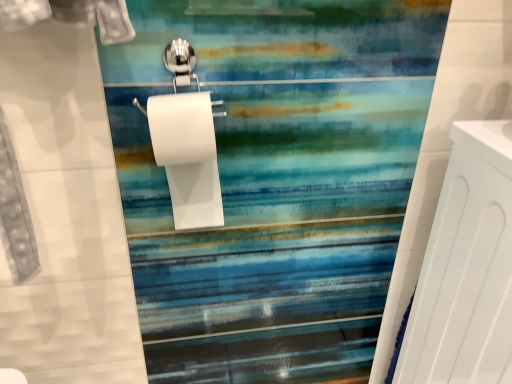
Identify the location of white matte toilet paper at center. (187, 156).

Measure the distance between point (188,149) and camera.

A distance of 25.91 inches exists between point (188,149) and camera.

The image size is (512, 384). What do you see at coordinates (187, 156) in the screenshot?
I see `white matte toilet paper at center` at bounding box center [187, 156].

Image resolution: width=512 pixels, height=384 pixels. Describe the element at coordinates (466, 268) in the screenshot. I see `white matte radiator at right` at that location.

Identify the location of white matte radiator at right. (466, 268).

I want to click on white matte toilet paper at center, so click(187, 156).

Is white matte toilet paper at center at the right side of white matte radiator at right?

Incorrect, white matte toilet paper at center is not on the right side of white matte radiator at right.

Relative to white matte radiator at right, is white matte toilet paper at center in front or behind?

In the image, white matte toilet paper at center appears behind white matte radiator at right.

Between point (159, 137) and point (501, 133), which one is positioned behind?

Point (501, 133)

From the image's perspective, which one is positioned lower, white matte toilet paper at center or white matte radiator at right?

From the image's view, white matte radiator at right is below.

From a real-world perspective, is white matte toilet paper at center positioned over white matte radiator at right based on gravity?

Yes, from a real-world perspective, white matte toilet paper at center is over white matte radiator at right

Consider the image. Does white matte toilet paper at center have a greater width compared to white matte radiator at right?

No.

Does white matte toilet paper at center have a lesser height compared to white matte radiator at right?

Yes, white matte toilet paper at center is shorter than white matte radiator at right.

Looking at this image, is white matte toilet paper at center bigger than white matte radiator at right?

No.

Would you say white matte toilet paper at center is outside white matte radiator at right?

That's correct, white matte toilet paper at center is outside of white matte radiator at right.

Is white matte toilet paper at center touching white matte radiator at right?

white matte toilet paper at center and white matte radiator at right are clearly separated.

Is white matte toilet paper at center facing towards white matte radiator at right?

No, white matte toilet paper at center is not oriented towards white matte radiator at right.

How many degrees apart are the facing directions of white matte toilet paper at center and white matte radiator at right?

The angular difference between white matte toilet paper at center and white matte radiator at right is 2.55 degrees.

You are a GUI agent. You are given a task and a screenshot of the screen. Output one action in this format:
    pyautogui.click(x=<x>, y=<y>)
    Task: Click on the radiator on the right of white matte toilet paper at center
    This screenshot has width=512, height=384.
    Given the screenshot: What is the action you would take?
    pyautogui.click(x=466, y=268)

Considering the positions of objects white matte radiator at right and white matte toilet paper at center in the image provided, who is more to the left, white matte radiator at right or white matte toilet paper at center?

Positioned to the left is white matte toilet paper at center.

Is white matte radiator at right closer to the viewer compared to white matte toilet paper at center?

Yes, white matte radiator at right is closer to the viewer.

Is point (460, 260) less distant than point (158, 119)?

No, it is not.

From the image's perspective, who appears lower, white matte radiator at right or white matte toilet paper at center?

white matte radiator at right, from the image's perspective.

From a real-world perspective, does white matte radiator at right sit lower than white matte toilet paper at center?

Indeed, from a real-world perspective, white matte radiator at right is positioned beneath white matte toilet paper at center.

Which of these two, white matte radiator at right or white matte toilet paper at center, is wider?

With larger width is white matte radiator at right.

Does white matte radiator at right have a greater height compared to white matte toilet paper at center?

Correct, white matte radiator at right is much taller as white matte toilet paper at center.

Considering the relative sizes of white matte radiator at right and white matte toilet paper at center in the image provided, is white matte radiator at right bigger than white matte toilet paper at center?

Yes.

Would you say white matte radiator at right is inside or outside white matte toilet paper at center?

The correct answer is: outside.

Would you consider white matte radiator at right to be distant from white matte toilet paper at center?

That's not correct — white matte radiator at right is a little close to white matte toilet paper at center.

Is white matte toilet paper at center at the back of white matte radiator at right?

No, white matte radiator at right is not facing away from white matte toilet paper at center.

How different are the orientations of white matte radiator at right and white matte toilet paper at center in degrees?

The angular difference between white matte radiator at right and white matte toilet paper at center is 2.55 degrees.

How far apart are white matte radiator at right and white matte toilet paper at center?

A distance of 18.38 inches exists between white matte radiator at right and white matte toilet paper at center.

Find the location of `radiator located on the right of white matte toilet paper at center`. radiator located on the right of white matte toilet paper at center is located at coordinates 466,268.

Find the location of a particular element. The width and height of the screenshot is (512, 384). toilet paper above the white matte radiator at right (from the image's perspective) is located at coordinates (187, 156).

The image size is (512, 384). What are the coordinates of `radiator on the right side of white matte toilet paper at center` in the screenshot? It's located at (466, 268).